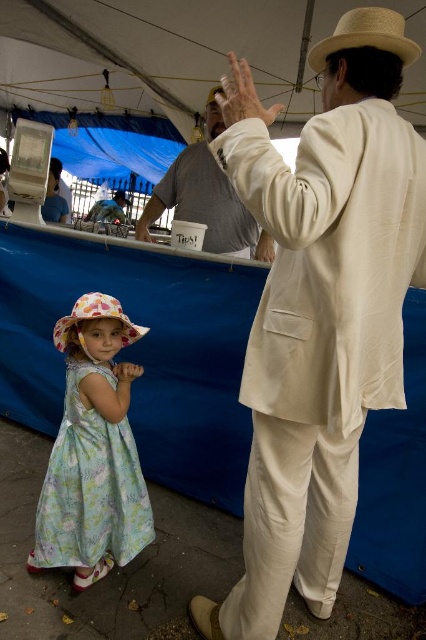
Question: Which point is closer to the camera?

Choices:
 (A) (316, 140)
 (B) (230, 196)
 (C) (210, 90)
 (D) (394, 26)

Answer: (A)

Question: Which point is closer to the camera?

Choices:
 (A) floral fabric sunhat at lower left
 (B) floral cotton dress at lower left
 (C) light gray cotton shirt at upper center
 (D) natural straw cowboy hat at upper right

Answer: (D)

Question: Does floral cotton dress at lower left appear on the left side of light gray cotton shirt at upper center?

Choices:
 (A) no
 (B) yes

Answer: (B)

Question: Can you confirm if light beige suit at right is positioned to the left of floral cotton dress at lower left?

Choices:
 (A) yes
 (B) no

Answer: (B)

Question: Is light beige suit at right closer to camera compared to natural straw cowboy hat at upper right?

Choices:
 (A) yes
 (B) no

Answer: (A)

Question: Which object is the farthest from the floral cotton dress at lower left?

Choices:
 (A) light gray cotton shirt at upper center
 (B) light beige suit at right
 (C) floral fabric sunhat at lower left
 (D) strawmaterial/texturehat at upper center

Answer: (D)